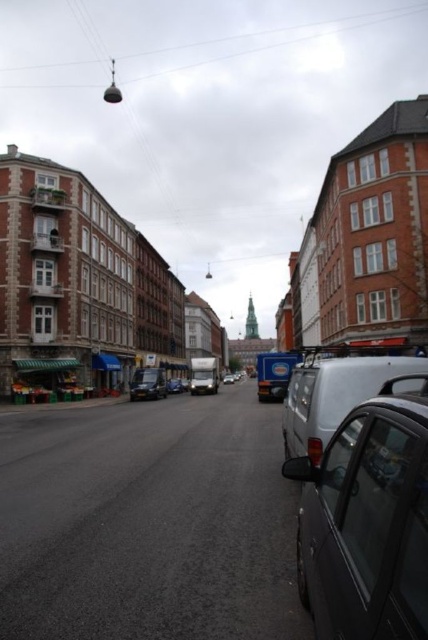
You are a delivery driver who needs to park your metallic silver van at center in a parking spot that can only accommodate vehicles smaller than the van. There is a black plastic license plate at center indicating the size limit. Can your van fit in the parking spot?

The metallic silver van at center is bigger than the black plastic license plate at center, which indicates the size limit. Therefore, the van cannot fit in the parking spot.